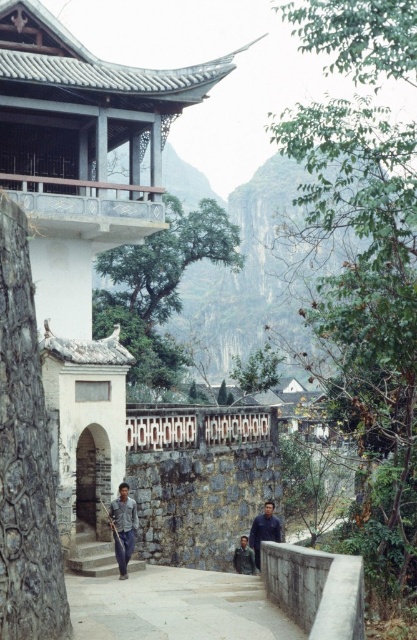
You are standing at the entrance of the pavilion and see a point marked at coordinates (82, 209). What does this point indicate?

The point at coordinates (82, 209) indicates the location of the white stone temple at left.

You are standing in front of the pavilion and see a man wearing a dark blue shirt at center and a dark gray fabric jacket at center. Which piece of clothing is nearer to you?

The dark blue shirt at center is closer to the viewer than the dark gray fabric jacket at center.